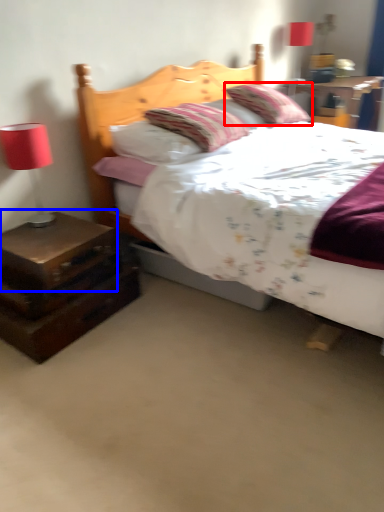
Question: Which object appears closest to the camera in this image, pillow (highlighted by a red box) or nightstand (highlighted by a blue box)?

Choices:
 (A) pillow
 (B) nightstand

Answer: (B)